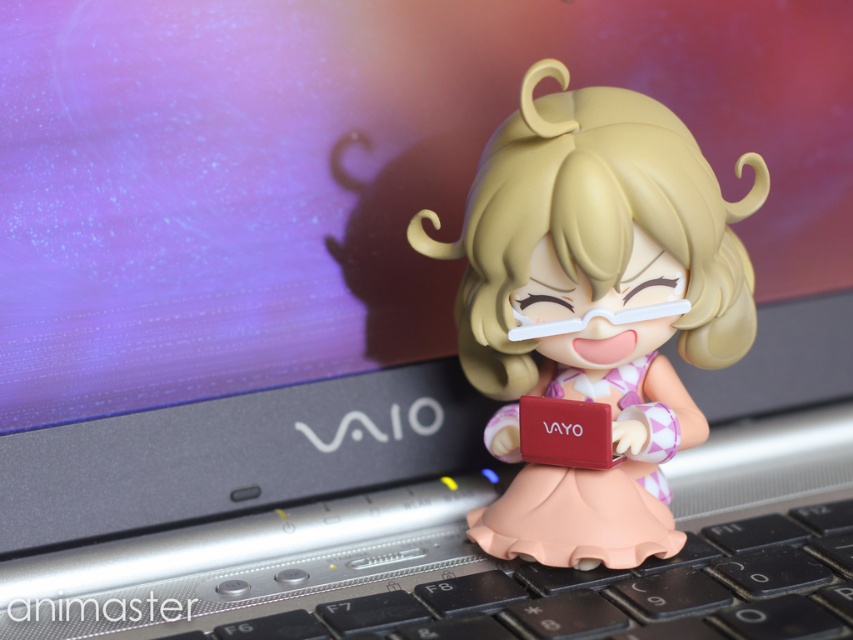
Is point (498, 518) closer to camera compared to point (821, 538)?

Yes, point (498, 518) is in front of point (821, 538).

At what (x,y) coordinates should I click in order to perform the action: click on matte plastic figurine at center. Please return your answer as a coordinate pair (x, y). Looking at the image, I should click on (596, 305).

Find the location of a particular element. matte plastic figurine at center is located at coordinates (596, 305).